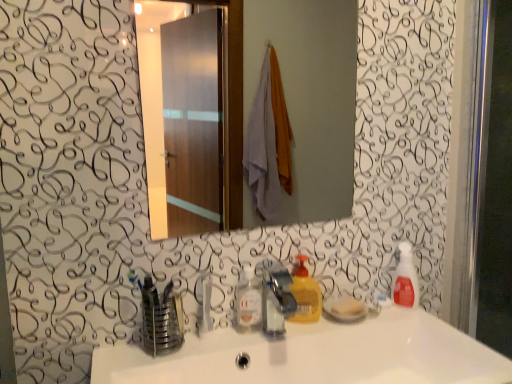
This screenshot has width=512, height=384. Describe the element at coordinates (405, 279) in the screenshot. I see `translucent plastic soap dispenser at right` at that location.

The width and height of the screenshot is (512, 384). What are the coordinates of `yellow matte liquid soap at center` in the screenshot? It's located at (305, 294).

Find the location of a particular element. satin nickel faucet at center is located at coordinates (276, 298).

You are a GUI agent. You are given a task and a screenshot of the screen. Output one action in this format:
    pyautogui.click(x=<x>, y=<y>)
    Task: Click on the white glossy sink at center
    The width and height of the screenshot is (512, 384).
    Given the screenshot: What is the action you would take?
    pyautogui.click(x=316, y=355)

Image resolution: width=512 pixels, height=384 pixels. Find the location of `translucent plastic soap dispenser at right`. translucent plastic soap dispenser at right is located at coordinates (405, 279).

Considering the relative positions of translucent plastic soap dispenser at right and white glossy sink at center in the image provided, is translucent plastic soap dispenser at right to the left of white glossy sink at center from the viewer's perspective?

Incorrect, translucent plastic soap dispenser at right is not on the left side of white glossy sink at center.

Identify the location of soap dispenser lying on the right of white glossy sink at center. (405, 279).

Would you say translucent plastic soap dispenser at right is inside or outside white glossy sink at center?

translucent plastic soap dispenser at right is spatially situated outside white glossy sink at center.

Can you tell me how much translucent plastic soap dispenser at right and white glossy sink at center differ in facing direction?

46.8 degrees.

Would you consider translucent plastic soap dispenser at right to be distant from satin nickel faucet at center?

No, translucent plastic soap dispenser at right is not far from satin nickel faucet at center.

Considering the sizes of objects translucent plastic soap dispenser at right and satin nickel faucet at center in the image provided, who is wider, translucent plastic soap dispenser at right or satin nickel faucet at center?

satin nickel faucet at center is wider.

Does translucent plastic soap dispenser at right have a greater height compared to satin nickel faucet at center?

Yes.

Is translucent plastic soap dispenser at right positioned with its back to satin nickel faucet at center?

No, translucent plastic soap dispenser at right's orientation is not away from satin nickel faucet at center.

Is clear plastic bottle at center at the right side of satin nickel faucet at center?

Incorrect, clear plastic bottle at center is not on the right side of satin nickel faucet at center.

Looking at this image, can you confirm if clear plastic bottle at center is bigger than satin nickel faucet at center?

Incorrect, clear plastic bottle at center is not larger than satin nickel faucet at center.

Is clear plastic bottle at center placed right next to satin nickel faucet at center?

Absolutely, clear plastic bottle at center is next to and touching satin nickel faucet at center.

Does clear plastic bottle at center lie in front of satin nickel faucet at center?

No, it is not.

Where is `cleaning product below the translucent plastic soap dispenser at right (from a real-world perspective)`? The width and height of the screenshot is (512, 384). cleaning product below the translucent plastic soap dispenser at right (from a real-world perspective) is located at coordinates (305, 294).

Which is more to the left, translucent plastic soap dispenser at right or yellow matte liquid soap at center?

yellow matte liquid soap at center is more to the left.

Looking at this image, between translucent plastic soap dispenser at right and yellow matte liquid soap at center, which one has larger width?

Wider between the two is translucent plastic soap dispenser at right.

How many degrees apart are the facing directions of translucent plastic soap dispenser at right and yellow matte liquid soap at center?

The angular difference between translucent plastic soap dispenser at right and yellow matte liquid soap at center is 40.5 degrees.

From the picture: Is clear plastic bottle at center aimed at white glossy sink at center?

Yes.

Which of these two, clear plastic bottle at center or white glossy sink at center, is bigger?

With larger size is white glossy sink at center.

Between clear plastic bottle at center and white glossy sink at center, which one appears on the right side from the viewer's perspective?

white glossy sink at center is more to the right.

In the scene shown: Is the position of translucent plastic soap dispenser at right less distant than that of clear plastic bottle at center?

No, translucent plastic soap dispenser at right is behind clear plastic bottle at center.

Considering the sizes of objects translucent plastic soap dispenser at right and clear plastic bottle at center in the image provided, who is thinner, translucent plastic soap dispenser at right or clear plastic bottle at center?

With smaller width is clear plastic bottle at center.

From a real-world perspective, relative to clear plastic bottle at center, is translucent plastic soap dispenser at right vertically above or below?

In terms of real-world spatial position, translucent plastic soap dispenser at right is above clear plastic bottle at center.

Between translucent plastic soap dispenser at right and clear plastic bottle at center, which one has less height?

Standing shorter between the two is clear plastic bottle at center.

From the image's perspective, is white glossy sink at center beneath satin nickel faucet at center?

Yes.

Considering the sizes of objects white glossy sink at center and satin nickel faucet at center in the image provided, who is smaller, white glossy sink at center or satin nickel faucet at center?

Smaller between the two is satin nickel faucet at center.

Who is taller, white glossy sink at center or satin nickel faucet at center?

Standing taller between the two is satin nickel faucet at center.

Which is behind, white glossy sink at center or satin nickel faucet at center?

satin nickel faucet at center.

The width and height of the screenshot is (512, 384). Find the location of `sink below the translucent plastic soap dispenser at right (from a real-world perspective)`. sink below the translucent plastic soap dispenser at right (from a real-world perspective) is located at coordinates [x=316, y=355].

Identify the location of soap dispenser that is on the right side of satin nickel faucet at center. This screenshot has width=512, height=384. (405, 279).

Based on their spatial positions, is satin nickel faucet at center or yellow matte liquid soap at center closer to translucent plastic soap dispenser at right?

Based on the image, yellow matte liquid soap at center appears to be nearer to translucent plastic soap dispenser at right.

Which object lies nearer to the anchor point translucent plastic soap dispenser at right, yellow matte liquid soap at center or white glossy sink at center?

yellow matte liquid soap at center is closer to translucent plastic soap dispenser at right.

Estimate the real-world distances between objects in this image. Which object is further from clear plastic bottle at center, translucent plastic soap dispenser at right or metallic reflective mirror at center?

metallic reflective mirror at center is positioned further to the anchor clear plastic bottle at center.

When comparing their distances from yellow matte liquid soap at center, does clear plastic bottle at center or metallic reflective mirror at center seem further?

Based on the image, metallic reflective mirror at center appears to be further to yellow matte liquid soap at center.

Considering their positions, is satin nickel faucet at center positioned further to clear plastic bottle at center than white glossy sink at center?

Among the two, white glossy sink at center is located further to clear plastic bottle at center.

Looking at the image, which one is located closer to satin nickel faucet at center, white glossy sink at center or yellow matte liquid soap at center?

yellow matte liquid soap at center lies closer to satin nickel faucet at center than the other object.

Considering their positions, is clear plastic bottle at center positioned further to metallic reflective mirror at center than translucent plastic soap dispenser at right?

clear plastic bottle at center is positioned further to the anchor metallic reflective mirror at center.

When comparing their distances from satin nickel faucet at center, does translucent plastic soap dispenser at right or white glossy sink at center seem closer?

white glossy sink at center is positioned closer to the anchor satin nickel faucet at center.

At what (x,y) coordinates should I click in order to perform the action: click on cleaning product between satin nickel faucet at center and translucent plastic soap dispenser at right in the horizontal direction. Please return your answer as a coordinate pair (x, y). Looking at the image, I should click on (305, 294).

Identify the location of soap dispenser that lies between metallic reflective mirror at center and yellow matte liquid soap at center from top to bottom. click(405, 279).

In order to click on bottle located between white glossy sink at center and translucent plastic soap dispenser at right in the depth direction in this screenshot , I will do `click(247, 300)`.

Locate an element on the screen. Image resolution: width=512 pixels, height=384 pixels. soap dispenser that lies between metallic reflective mirror at center and satin nickel faucet at center from top to bottom is located at coordinates (405, 279).